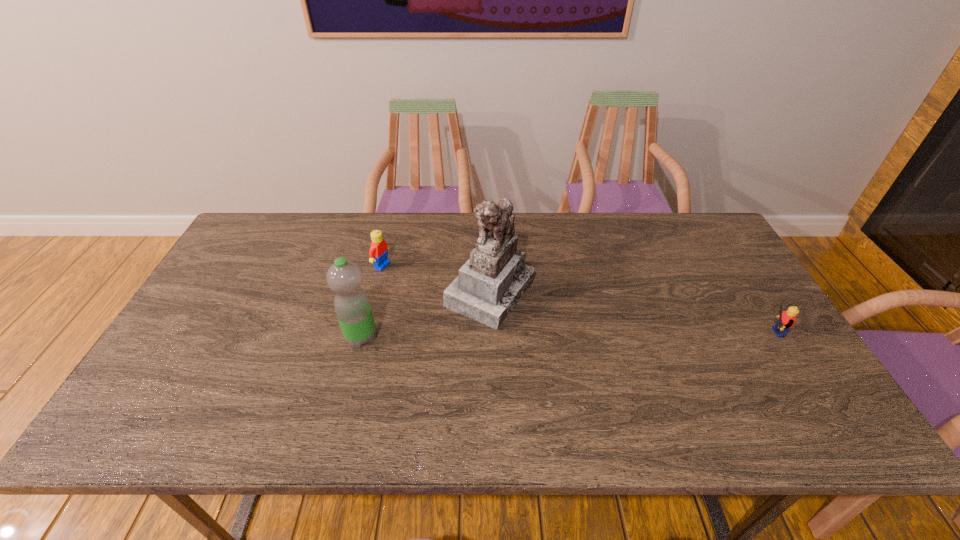
At what (x,y) coordinates should I click in order to perform the action: click on free space located on the front-facing side of the tallest object. Please return your answer as a coordinate pair (x, y). This screenshot has width=960, height=540. Looking at the image, I should click on (650, 362).

Find the location of a particular element. The height and width of the screenshot is (540, 960). free spot located 0.320m on the front-facing side of the tallest object is located at coordinates (646, 360).

Locate an element on the screen. The width and height of the screenshot is (960, 540). vacant space situated on the front-facing side of the tallest object is located at coordinates (596, 339).

The width and height of the screenshot is (960, 540). I want to click on free space located on the face of the left Lego, so click(x=418, y=282).

I want to click on free location located on the face of the left Lego, so click(483, 309).

Where is `vacant space situated on the face of the left Lego`? vacant space situated on the face of the left Lego is located at coordinates (429, 287).

Where is `figurine that is at the far edge`? The image size is (960, 540). figurine that is at the far edge is located at coordinates (489, 285).

Image resolution: width=960 pixels, height=540 pixels. In order to click on Lego situated at the far edge in this screenshot , I will do `click(378, 253)`.

Locate an element on the screen. object present at the right edge is located at coordinates (786, 320).

I want to click on vacant space at the far edge of the desktop, so click(x=412, y=240).